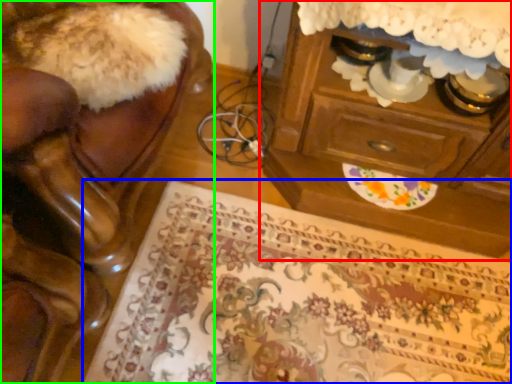
Question: Based on their relative distances, which object is farther from chest of drawers (highlighted by a red box)? Choose from mat (highlighted by a blue box) and furniture (highlighted by a green box).

Choices:
 (A) mat
 (B) furniture

Answer: (B)